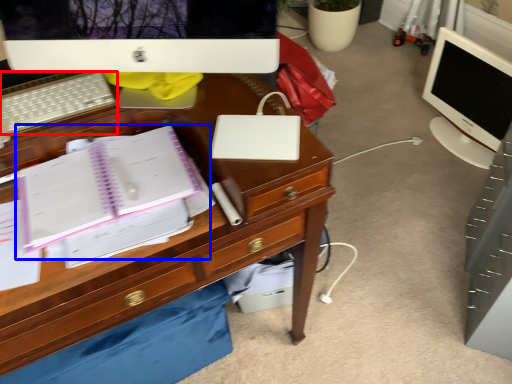
Question: Which object appears farthest to the camera in this image, computer keyboard (highlighted by a red box) or notebook (highlighted by a blue box)?

Choices:
 (A) computer keyboard
 (B) notebook

Answer: (A)